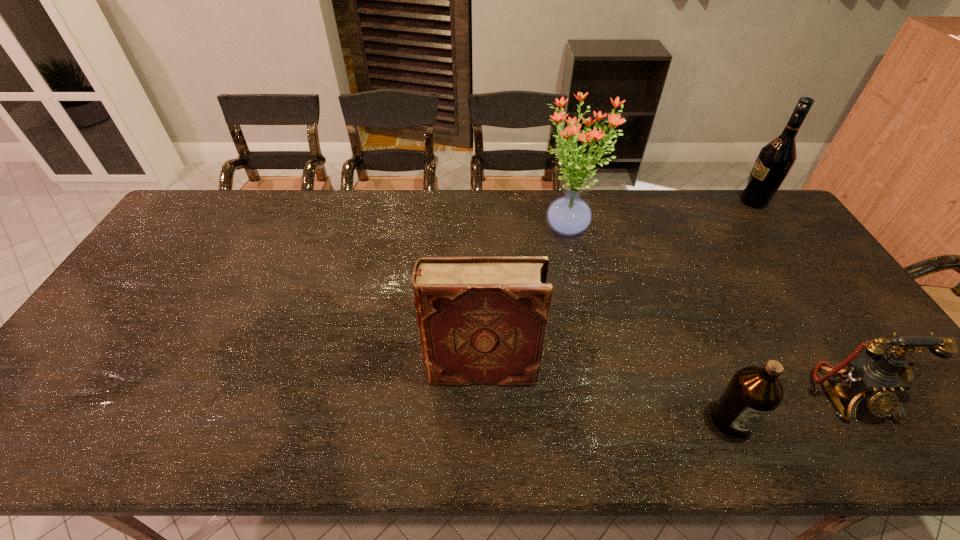
Identify the location of the second object from left to right. (569, 215).

This screenshot has width=960, height=540. I want to click on wine bottle, so click(x=775, y=160).

Where is `the leftmost object`? Image resolution: width=960 pixels, height=540 pixels. the leftmost object is located at coordinates (482, 320).

Where is `telephone`? The image size is (960, 540). telephone is located at coordinates (877, 378).

At what (x,y) coordinates should I click in order to perform the action: click on the third object from left to right. Please return your answer as a coordinate pair (x, y). Looking at the image, I should click on (753, 393).

Locate an element on the screen. free space located on the front of the flower arrangement is located at coordinates (590, 331).

The image size is (960, 540). Identify the location of vacant space located 0.050m on the label of the wine bottle. (725, 201).

The image size is (960, 540). In order to click on free space located on the label of the wine bottle in this screenshot , I will do `click(722, 201)`.

This screenshot has height=540, width=960. What are the coordinates of `vacant space situated 0.400m on the label of the wine bottle` in the screenshot? It's located at (627, 201).

I want to click on free space located on the spine side of the hardback book, so [268, 369].